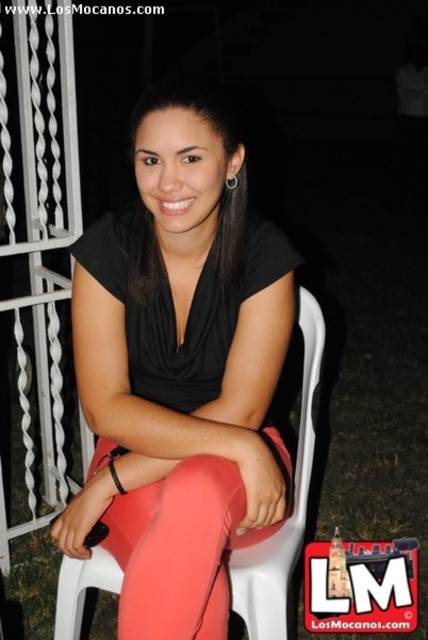
Question: Which object is farther from the camera taking this photo?

Choices:
 (A) matte pink leggings at center
 (B) matte black top at center

Answer: (B)

Question: Can you confirm if matte black top at center is positioned to the right of matte pink leggings at center?

Choices:
 (A) yes
 (B) no

Answer: (A)

Question: Which object appears farthest from the camera in this image?

Choices:
 (A) matte pink leggings at center
 (B) matte black top at center

Answer: (B)

Question: Does matte black top at center appear under matte pink leggings at center?

Choices:
 (A) yes
 (B) no

Answer: (B)

Question: Does matte black top at center have a lesser width compared to matte pink leggings at center?

Choices:
 (A) yes
 (B) no

Answer: (B)